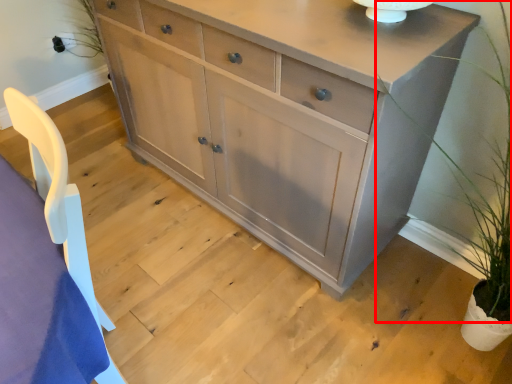
Question: From the image's perspective, considering the relative positions of plant (annotated by the red box) and chest of drawers in the image provided, where is plant (annotated by the red box) located with respect to the staircase?

Choices:
 (A) above
 (B) below

Answer: (B)